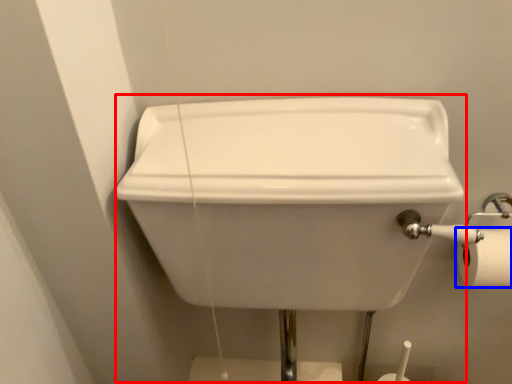
Question: Which object appears farthest to the camera in this image, sink (highlighted by a red box) or toilet paper (highlighted by a blue box)?

Choices:
 (A) sink
 (B) toilet paper

Answer: (B)